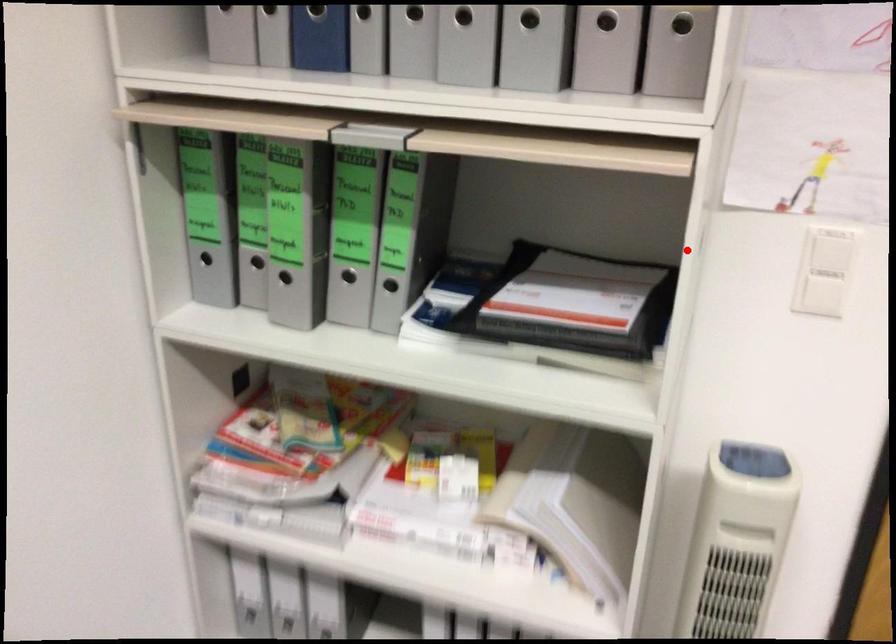
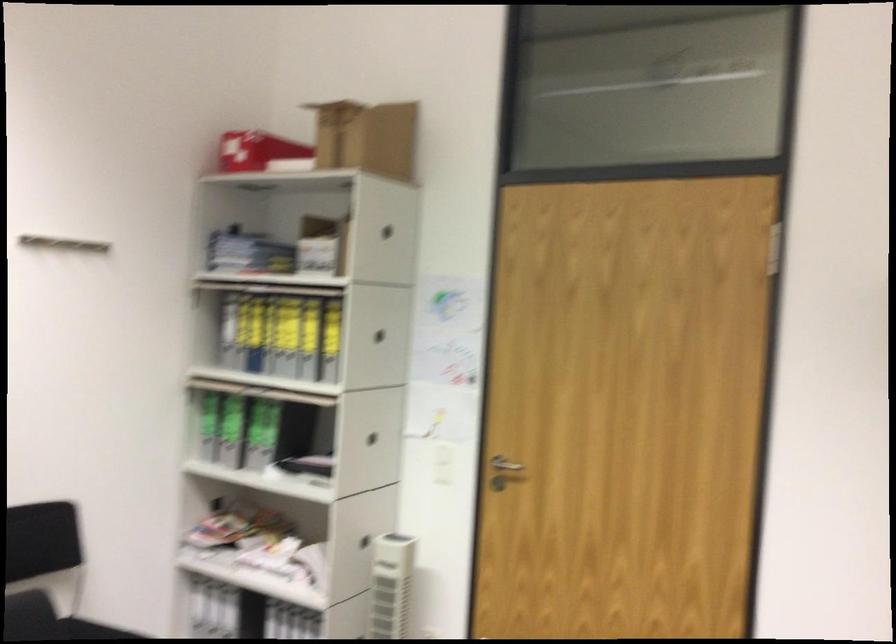
The point at the highlighted location is marked in the first image. Where is the corresponding point in the second image?

(372, 438)